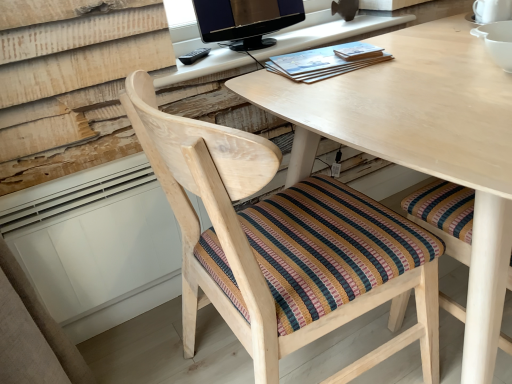
Locate an element on the screen. Image resolution: width=512 pixels, height=384 pixels. free space to the right of blue paperback book at center is located at coordinates (419, 49).